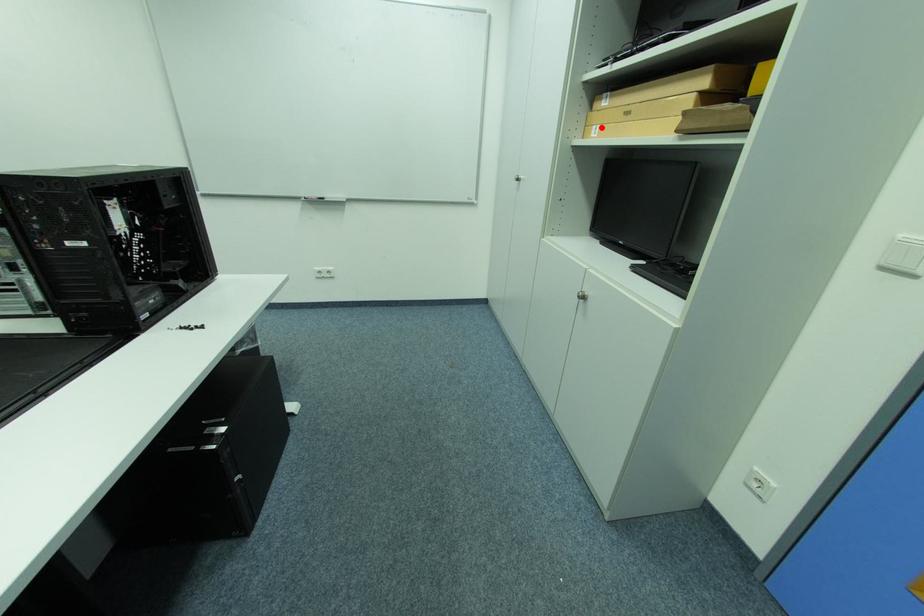
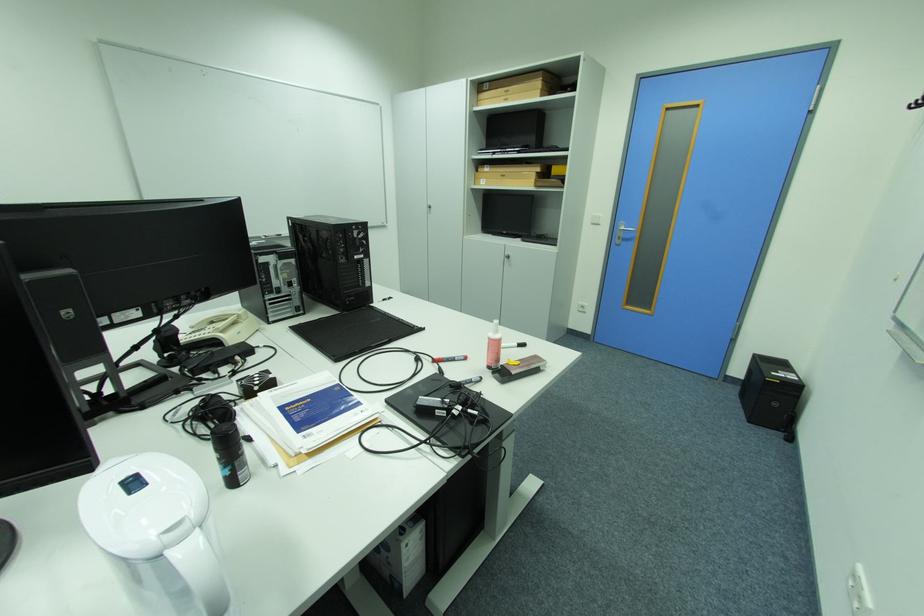
In the second image, find the point that corresponds to the highlighted location in the first image.

(490, 180)